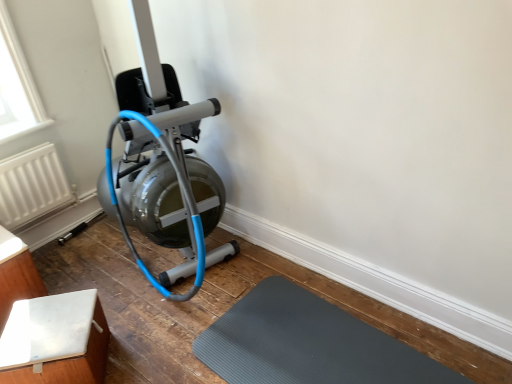
Question: Can you confirm if gray rubber mat at lower center is wider than white matte table at lower left, the 2th furniture from the right?

Choices:
 (A) yes
 (B) no

Answer: (A)

Question: Is gray rubber mat at lower center thinner than white matte table at lower left, the 2th furniture from the right?

Choices:
 (A) yes
 (B) no

Answer: (B)

Question: Does gray rubber mat at lower center have a smaller size compared to white matte table at lower left, the 2th furniture from the right?

Choices:
 (A) no
 (B) yes

Answer: (B)

Question: From a real-world perspective, is gray rubber mat at lower center physically above white matte table at lower left, the 2th furniture from the right?

Choices:
 (A) no
 (B) yes

Answer: (A)

Question: Are gray rubber mat at lower center and white matte table at lower left, positioned as the first furniture in left-to-right order, located far from each other?

Choices:
 (A) no
 (B) yes

Answer: (B)

Question: In terms of height, does white matte table at lower left, the 2th furniture viewed from the left, look taller or shorter compared to white matte table at lower left, the 2th furniture from the right?

Choices:
 (A) tall
 (B) short

Answer: (B)

Question: Considering the positions of point (48, 306) and point (4, 322), is point (48, 306) closer or farther from the camera than point (4, 322)?

Choices:
 (A) closer
 (B) farther

Answer: (A)

Question: From the image's perspective, is white matte table at lower left, the 2th furniture viewed from the left, located above or below white matte table at lower left, positioned as the first furniture in left-to-right order?

Choices:
 (A) above
 (B) below

Answer: (B)

Question: From a real-world perspective, is white matte table at lower left, the 1th furniture when ordered from right to left, positioned above or below white matte table at lower left, positioned as the first furniture in left-to-right order?

Choices:
 (A) above
 (B) below

Answer: (B)

Question: Looking at their shapes, would you say matte silver stationary bicycle at left is wider or thinner than white matte table at lower left, the 2th furniture from the right?

Choices:
 (A) thin
 (B) wide

Answer: (B)

Question: Is matte silver stationary bicycle at left taller or shorter than white matte table at lower left, the 2th furniture from the right?

Choices:
 (A) short
 (B) tall

Answer: (B)

Question: Is matte silver stationary bicycle at left in front of or behind white matte table at lower left, the 2th furniture from the right, in the image?

Choices:
 (A) front
 (B) behind

Answer: (A)

Question: Is point (124, 130) closer or farther from the camera than point (7, 278)?

Choices:
 (A) closer
 (B) farther

Answer: (A)

Question: Considering the positions of white textured radiator at left and matte silver stationary bicycle at left in the image, is white textured radiator at left taller or shorter than matte silver stationary bicycle at left?

Choices:
 (A) short
 (B) tall

Answer: (A)

Question: From a real-world perspective, relative to matte silver stationary bicycle at left, is white textured radiator at left vertically above or below?

Choices:
 (A) above
 (B) below

Answer: (B)